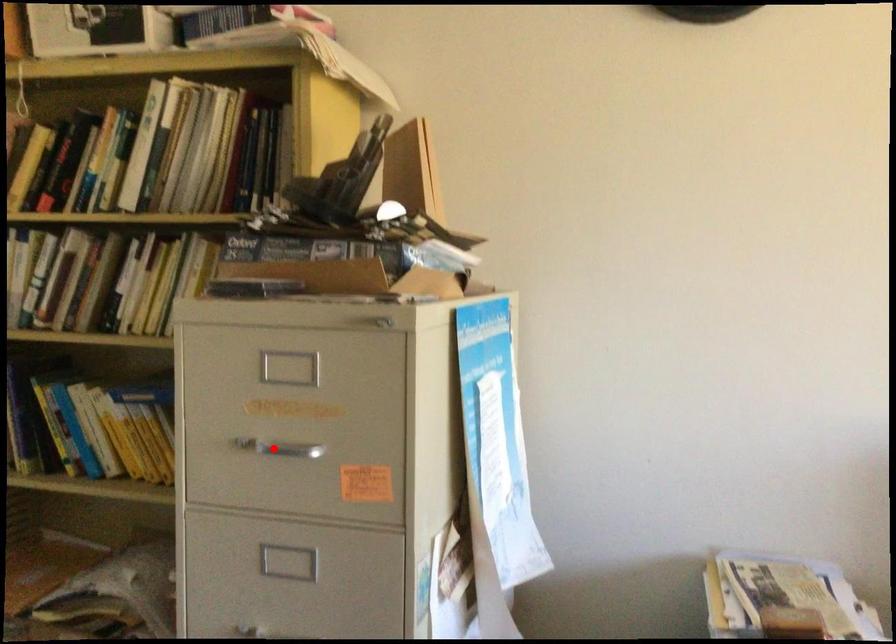
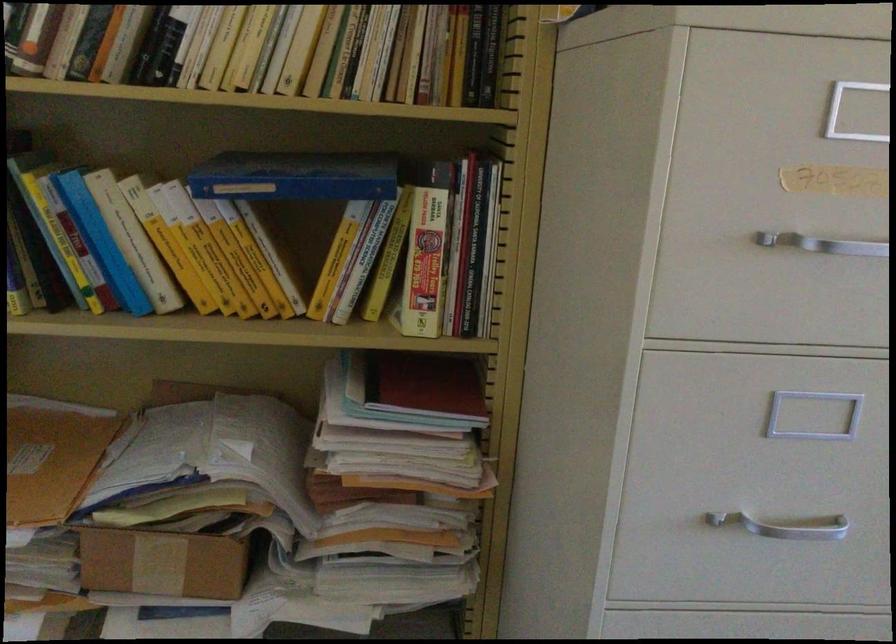
Find the pixel in the second image that matches the highlighted location in the first image.

(823, 243)